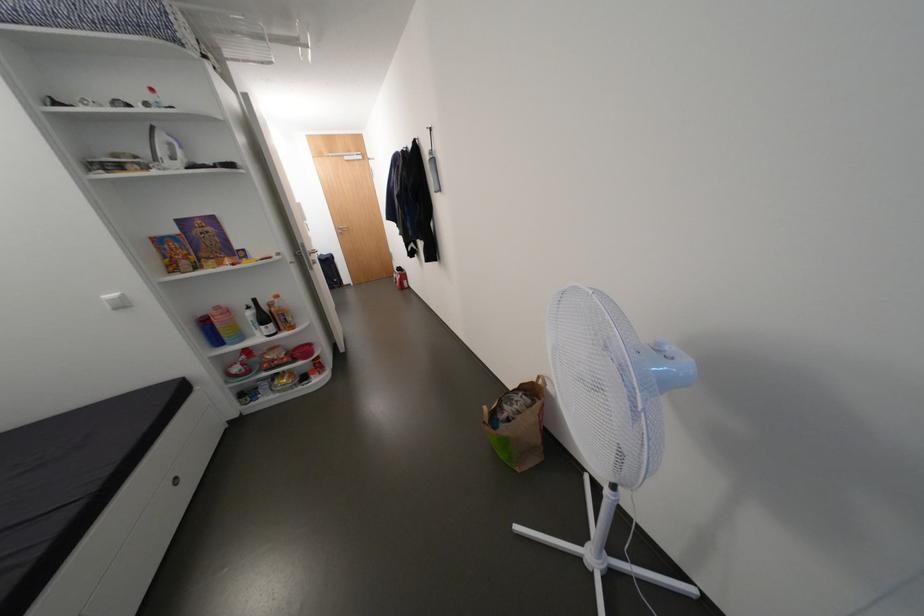
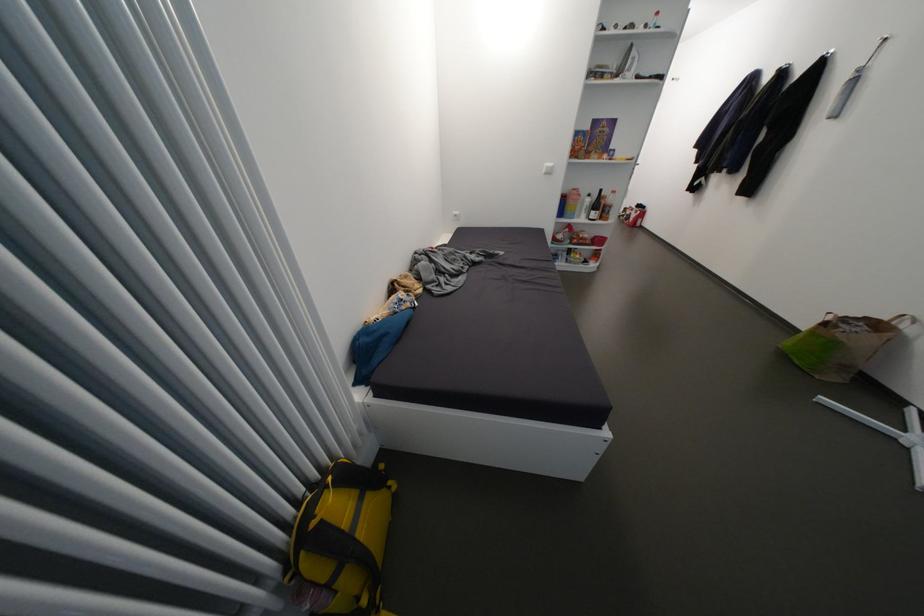
Where in the second image is the point corresponding to (228,315) from the first image?

(585, 196)